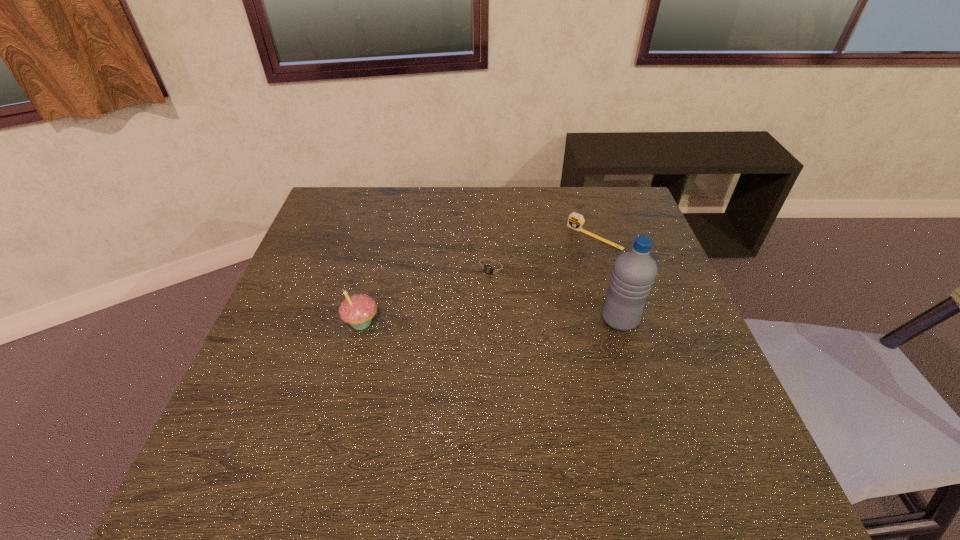
You are a GUI agent. You are given a task and a screenshot of the screen. Output one action in this format:
    pyautogui.click(x=<x>, y=<y>)
    Task: Click on the free space at the near edge of the desktop
    
    Given the screenshot: What is the action you would take?
    pyautogui.click(x=415, y=415)

In the image, there is a desktop. In order to click on blank space at the left edge in this screenshot , I will do `click(302, 325)`.

You are a GUI agent. You are given a task and a screenshot of the screen. Output one action in this format:
    pyautogui.click(x=<x>, y=<y>)
    Task: Click on the vacant space at the right edge
    The image size is (960, 540).
    Given the screenshot: What is the action you would take?
    pyautogui.click(x=674, y=363)

Locate an element on the screen. vacant space at the far left corner of the desktop is located at coordinates (372, 195).

The image size is (960, 540). In the image, there is a desktop. Find the location of `free space at the far right corner`. free space at the far right corner is located at coordinates (607, 223).

Find the location of a particular element. This screenshot has width=960, height=540. free space between the tallest object and the second farthest object is located at coordinates (556, 294).

The image size is (960, 540). I want to click on vacant area that lies between the shortest object and the farthest object, so click(x=543, y=253).

Find the location of a particular element. free spot between the shortest object and the tallest object is located at coordinates (556, 294).

Find the location of `unoccupied area between the water bottle and the cupcake`. unoccupied area between the water bottle and the cupcake is located at coordinates (491, 321).

Where is `free spot between the second tallest object and the water bottle`? The height and width of the screenshot is (540, 960). free spot between the second tallest object and the water bottle is located at coordinates (491, 321).